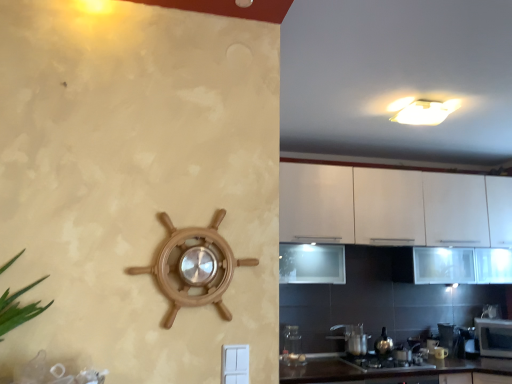
Measure the distance between transparent glass jar at lower center, arranged as the 5th appliance when viewed from the back, and camera.

The depth of transparent glass jar at lower center, arranged as the 5th appliance when viewed from the back, is 3.02 meters.

The width and height of the screenshot is (512, 384). What do you see at coordinates (386, 206) in the screenshot?
I see `white glossy cabinet at upper center` at bounding box center [386, 206].

I want to click on satin silver kettle at lower center, the fourth appliance viewed from the right, so click(352, 338).

Identify the location of transparent glass jar at lower center, which is the second appliance from top to bottom. (292, 347).

Is satin silver kettle at lower center, positioned as the 3th appliance in left-to-right order, turned away from white glossy cabinet at upper center?

No, white glossy cabinet at upper center is not at the back of satin silver kettle at lower center, positioned as the 3th appliance in left-to-right order.

Based on the photo, from the image's perspective, between satin silver kettle at lower center, which appears as the fourth appliance when ordered from the bottom, and white glossy cabinet at upper center, who is located below?

From the image's view, satin silver kettle at lower center, which appears as the fourth appliance when ordered from the bottom, is below.

How many degrees apart are the facing directions of satin silver kettle at lower center, the third appliance positioned from the top, and white glossy cabinet at upper center?

1.37e-05 degrees.

Is satin silver kettle at lower center, the fourth appliance viewed from the right, not near white glossy cabinet at upper center?

satin silver kettle at lower center, the fourth appliance viewed from the right, is positioned a significant distance from white glossy cabinet at upper center.

Looking at this image, from the image's perspective, is metallic silver kettle at lower right, the third appliance positioned from the right, on top of transparent glass jar at lower center, which is the 2th appliance from left to right?

No, from the image's perspective, metallic silver kettle at lower right, the third appliance positioned from the right, is not on top of transparent glass jar at lower center, which is the 2th appliance from left to right.

Considering the relative sizes of metallic silver kettle at lower right, the third appliance positioned from the right, and transparent glass jar at lower center, arranged as the 5th appliance when viewed from the back, in the image provided, is metallic silver kettle at lower right, the third appliance positioned from the right, thinner than transparent glass jar at lower center, arranged as the 5th appliance when viewed from the back,?

Yes.

Consider the image. Is metallic silver kettle at lower right, the 3th appliance positioned from the bottom, looking in the opposite direction of transparent glass jar at lower center, which is the 5th appliance from right to left?

No, transparent glass jar at lower center, which is the 5th appliance from right to left, is not at the back of metallic silver kettle at lower right, the 3th appliance positioned from the bottom.

Is the position of metallic silver gas stove at lower center less distant than that of satin silver kettle at lower center, the third appliance positioned from the top?

That is True.

Consider the image. Considering the sizes of objects metallic silver gas stove at lower center and satin silver kettle at lower center, which is counted as the fourth appliance, starting from the back, in the image provided, who is taller, metallic silver gas stove at lower center or satin silver kettle at lower center, which is counted as the fourth appliance, starting from the back,?

With more height is satin silver kettle at lower center, which is counted as the fourth appliance, starting from the back.

Considering the sizes of metallic silver gas stove at lower center and satin silver kettle at lower center, which is the third appliance in front-to-back order, in the image, is metallic silver gas stove at lower center wider or thinner than satin silver kettle at lower center, which is the third appliance in front-to-back order,?

metallic silver gas stove at lower center is wider than satin silver kettle at lower center, which is the third appliance in front-to-back order.

You are a GUI agent. You are given a task and a screenshot of the screen. Output one action in this format:
    pyautogui.click(x=<x>, y=<y>)
    Task: Click on the gas stove that is on the left side of metallic silver toaster at lower right, which appears as the 2th appliance when ordered from the bottom
    
    Given the screenshot: What is the action you would take?
    pyautogui.click(x=385, y=364)

Which object is wider, metallic silver toaster at lower right, which appears as the 2th appliance when ordered from the bottom, or metallic silver gas stove at lower center?

metallic silver gas stove at lower center.

Between point (450, 324) and point (409, 353), which one is positioned behind?

The point (450, 324) is farther from the camera.

In the scene shown: Considering the sizes of objects metallic silver toaster at lower right, the second appliance when ordered from back to front, and silver metallic microwave at lower right in the image provided, who is thinner, metallic silver toaster at lower right, the second appliance when ordered from back to front, or silver metallic microwave at lower right?

metallic silver toaster at lower right, the second appliance when ordered from back to front, is thinner.

Is metallic silver toaster at lower right, the 5th appliance from the top, aimed at silver metallic microwave at lower right?

No, metallic silver toaster at lower right, the 5th appliance from the top, is not oriented towards silver metallic microwave at lower right.

From a real-world perspective, between metallic silver toaster at lower right, the second appliance when ordered from back to front, and silver metallic microwave at lower right, who is vertically higher?

silver metallic microwave at lower right is physically above.

Based on their sizes in the image, would you say metallic silver toaster at lower right, marked as the first appliance in a right-to-left arrangement, is bigger or smaller than silver metallic microwave at lower right?

Considering their sizes, metallic silver toaster at lower right, marked as the first appliance in a right-to-left arrangement, takes up less space than silver metallic microwave at lower right.

Can we say white glossy cabinet at upper center lies outside wooden ship wheel at center, arranged as the first appliance when viewed from the front?

white glossy cabinet at upper center lies outside wooden ship wheel at center, arranged as the first appliance when viewed from the front,'s area.

Does point (402, 173) lie in front of point (224, 210)?

No, (402, 173) is further to viewer.

Is white glossy cabinet at upper center oriented towards wooden ship wheel at center, arranged as the first appliance when viewed from the front?

Yes, white glossy cabinet at upper center is facing wooden ship wheel at center, arranged as the first appliance when viewed from the front.

Consider the image. In the image, is white glossy cabinet at upper center on the left side or the right side of wooden ship wheel at center, which is the sixth appliance in back-to-front order?

white glossy cabinet at upper center is to the right of wooden ship wheel at center, which is the sixth appliance in back-to-front order.

Does metallic silver kettle at lower right, which appears as the 6th appliance when viewed from the front, appear on the right side of metallic silver gas stove at lower center?

Yes, metallic silver kettle at lower right, which appears as the 6th appliance when viewed from the front, is to the right of metallic silver gas stove at lower center.

Is metallic silver kettle at lower right, which appears as the 6th appliance when viewed from the front, directly adjacent to metallic silver gas stove at lower center?

metallic silver kettle at lower right, which appears as the 6th appliance when viewed from the front, is not next to metallic silver gas stove at lower center, and they're not touching.

Would you say metallic silver kettle at lower right, the first appliance from the bottom, is inside or outside metallic silver gas stove at lower center?

metallic silver kettle at lower right, the first appliance from the bottom, is not inside metallic silver gas stove at lower center, it's outside.

Considering the sizes of objects metallic silver kettle at lower right, the first appliance from the bottom, and metallic silver gas stove at lower center in the image provided, who is bigger, metallic silver kettle at lower right, the first appliance from the bottom, or metallic silver gas stove at lower center?

With larger size is metallic silver gas stove at lower center.

Find the location of `cabinetry on the right side of satin silver kettle at lower center, the fourth appliance viewed from the right`. cabinetry on the right side of satin silver kettle at lower center, the fourth appliance viewed from the right is located at coordinates (386, 206).

At what (x,y) coordinates should I click in order to perform the action: click on the 2nd appliance above the metallic silver kettle at lower right, positioned as the 4th appliance in front-to-back order (from the image's perspective). Please return your answer as a coordinate pair (x, y). The image size is (512, 384). Looking at the image, I should click on (292, 347).

When comparing their distances from transparent glass jar at lower center, which is the second appliance from top to bottom, does silver metallic microwave at lower right or metallic silver kettle at lower right, which is counted as the third appliance, starting from the back, seem further?

silver metallic microwave at lower right is further to transparent glass jar at lower center, which is the second appliance from top to bottom.

From the picture: Based on their spatial positions, is white glossy cabinet at upper center or black glossy countertop at lower center further from wooden ship wheel at center, which is the 1th appliance in top-to-bottom order?

white glossy cabinet at upper center lies further to wooden ship wheel at center, which is the 1th appliance in top-to-bottom order, than the other object.

Looking at the image, which one is located closer to silver metallic microwave at lower right, satin silver kettle at lower center, the third appliance positioned from the top, or metallic silver kettle at lower right, which appears as the 6th appliance when viewed from the front?

metallic silver kettle at lower right, which appears as the 6th appliance when viewed from the front, is closer to silver metallic microwave at lower right.

When comparing their distances from metallic silver toaster at lower right, the second appliance when ordered from back to front, does silver metallic microwave at lower right or metallic silver gas stove at lower center seem further?

Among the two, metallic silver gas stove at lower center is located further to metallic silver toaster at lower right, the second appliance when ordered from back to front.

Based on their spatial positions, is metallic silver kettle at lower right, which is counted as the 4th appliance, starting from the top, or metallic silver kettle at lower right, which appears as the 6th appliance when viewed from the front, further from wooden ship wheel at center, acting as the 6th appliance starting from the bottom?

metallic silver kettle at lower right, which appears as the 6th appliance when viewed from the front, is further to wooden ship wheel at center, acting as the 6th appliance starting from the bottom.

From the image, which object appears to be farther from transparent glass jar at lower center, which is the 5th appliance from right to left, satin silver kettle at lower center, which appears as the fourth appliance when ordered from the bottom, or metallic silver gas stove at lower center?

metallic silver gas stove at lower center is further to transparent glass jar at lower center, which is the 5th appliance from right to left.

Consider the image. When comparing their distances from satin silver kettle at lower center, positioned as the 3th appliance in left-to-right order, does metallic silver kettle at lower right, acting as the fifth appliance starting from the left, or white glossy cabinet at upper center seem further?

The object further to satin silver kettle at lower center, positioned as the 3th appliance in left-to-right order, is white glossy cabinet at upper center.

Estimate the real-world distances between objects in this image. Which object is further from satin silver kettle at lower center, which appears as the fourth appliance when ordered from the bottom, metallic silver gas stove at lower center or metallic silver toaster at lower right, the sixth appliance when ordered from left to right?

metallic silver toaster at lower right, the sixth appliance when ordered from left to right, lies further to satin silver kettle at lower center, which appears as the fourth appliance when ordered from the bottom, than the other object.

Find the location of a particular element. The height and width of the screenshot is (384, 512). cabinetry located between wooden ship wheel at center, acting as the 6th appliance starting from the bottom, and transparent glass jar at lower center, the second appliance in the front-to-back sequence, in the depth direction is located at coordinates (386, 206).

The height and width of the screenshot is (384, 512). What are the coordinates of `cabinetry situated between transparent glass jar at lower center, which is the 5th appliance from right to left, and silver metallic microwave at lower right from left to right` in the screenshot? It's located at (386, 206).

At what (x,y) coordinates should I click in order to perform the action: click on cabinetry positioned between wooden ship wheel at center, which is the 6th appliance in right-to-left order, and satin silver kettle at lower center, positioned as the 3th appliance in left-to-right order, from near to far. Please return your answer as a coordinate pair (x, y). This screenshot has width=512, height=384. Looking at the image, I should click on (386, 206).

What are the coordinates of `countertop positioned between wooden ship wheel at center, which is the 1th appliance in top-to-bottom order, and metallic silver gas stove at lower center from near to far` in the screenshot? It's located at click(384, 370).